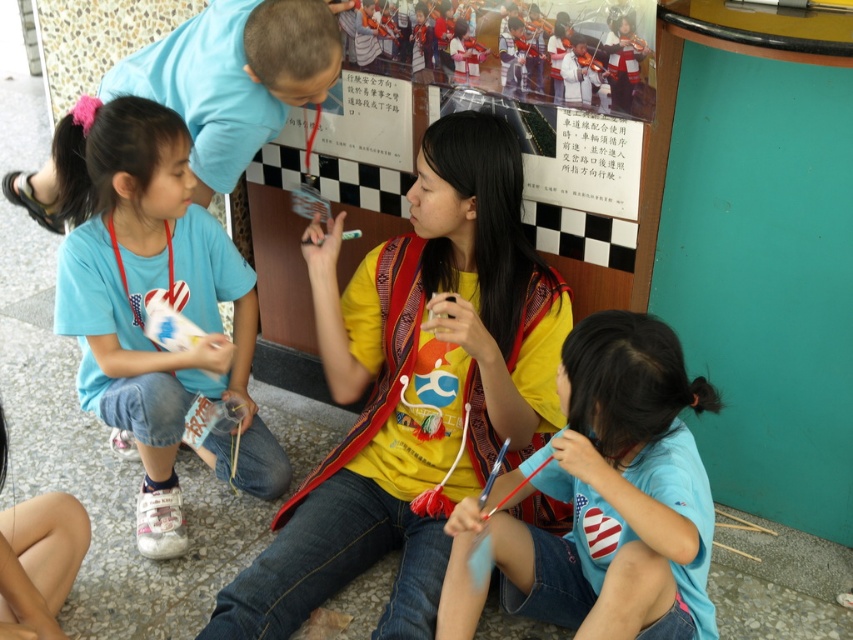
Question: Which point appears closest to the camera in this image?

Choices:
 (A) (212, 193)
 (B) (514, 275)
 (C) (165, 429)
 (D) (630, 572)

Answer: (D)

Question: Can you confirm if yellow matte shirt at center is bigger than blue fabric shirt at upper left?

Choices:
 (A) yes
 (B) no

Answer: (A)

Question: Does yellow matte shirt at center appear on the right side of blue fabric shirt at upper left?

Choices:
 (A) yes
 (B) no

Answer: (A)

Question: Which point is closer to the camera taking this photo?

Choices:
 (A) (184, 275)
 (B) (167, 42)

Answer: (B)

Question: Can you confirm if yellow matte shirt at center is thinner than light blue cotton shirt at lower left?

Choices:
 (A) yes
 (B) no

Answer: (B)

Question: Which point is farther from the camera taking this photo?

Choices:
 (A) (560, 612)
 (B) (445, 548)
 (C) (132, 225)

Answer: (C)